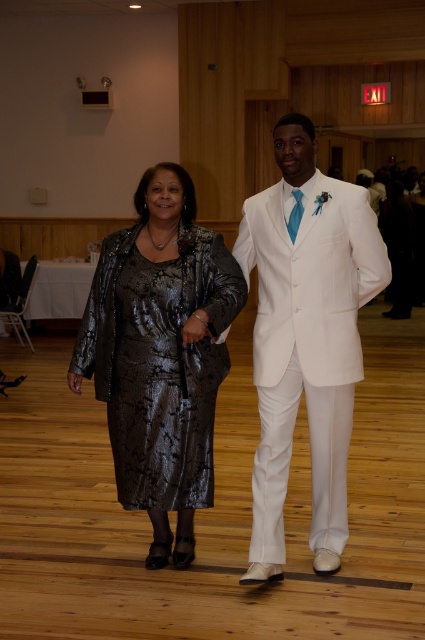
Question: Which point is closer to the camera taking this photo?

Choices:
 (A) (193, 324)
 (B) (376, 289)

Answer: (A)

Question: Is shiny metallic dress at center further to the viewer compared to white satin suit at center?

Choices:
 (A) no
 (B) yes

Answer: (B)

Question: From the image, what is the correct spatial relationship of shiny metallic dress at center in relation to white satin suit at center?

Choices:
 (A) left
 (B) right

Answer: (A)

Question: Does shiny metallic dress at center have a greater width compared to white satin suit at center?

Choices:
 (A) no
 (B) yes

Answer: (B)

Question: Which object appears farthest from the camera in this image?

Choices:
 (A) shiny metallic dress at center
 (B) white satin suit at center

Answer: (A)